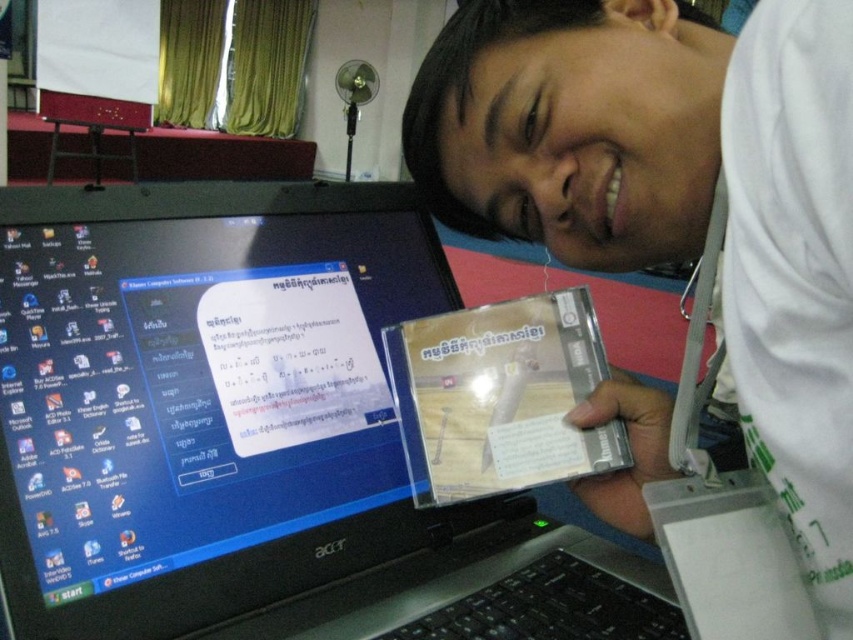
You need to place the white matte cd case at center on top of the black plastic laptop at center. Based on their sizes, will the cd case fit entirely on the laptop without hanging over the edges?

The black plastic laptop at center might be wider than white matte cd case at center, so there is a possibility that the cd case will fit, but it is uncertain since the exact dimensions are not provided.

You are a student trying to place both the black plastic laptop at center and the white matte cd case at center on a shelf that can only accommodate items shorter than the cd case. Which item should you place first to ensure both fit?

You should place the black plastic laptop at center first since it is shorter than the white matte cd case at center, allowing both items to fit on the shelf.